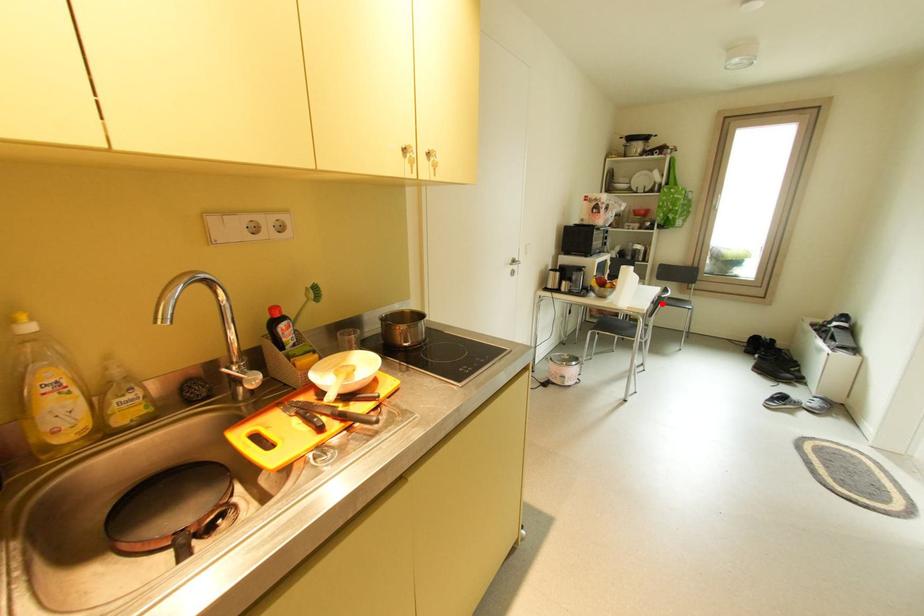
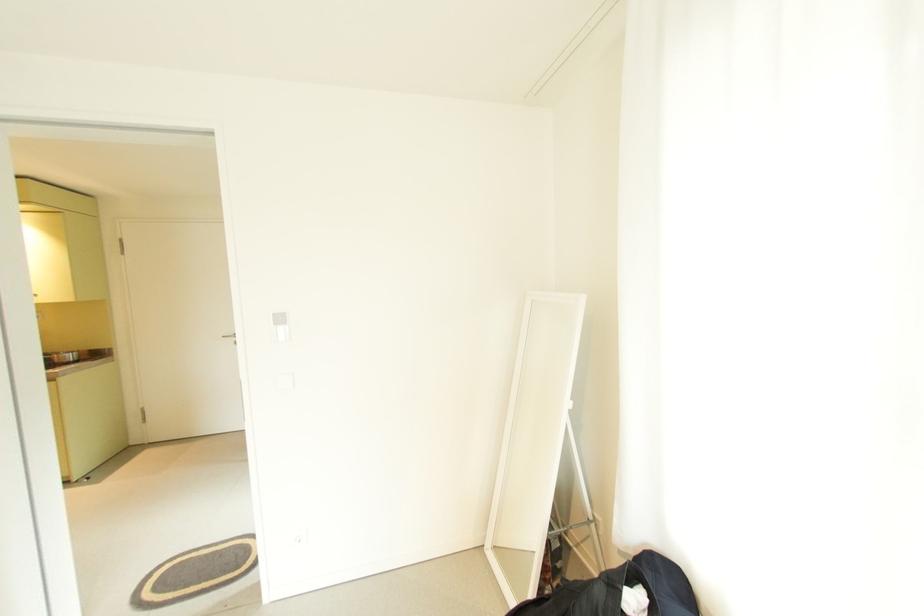
Question: I am providing you with two images of the same scene from different viewpoints. A red point is marked on the first image. Can you still see the location of the red point in image 2?

Choices:
 (A) Yes
 (B) No

Answer: (B)